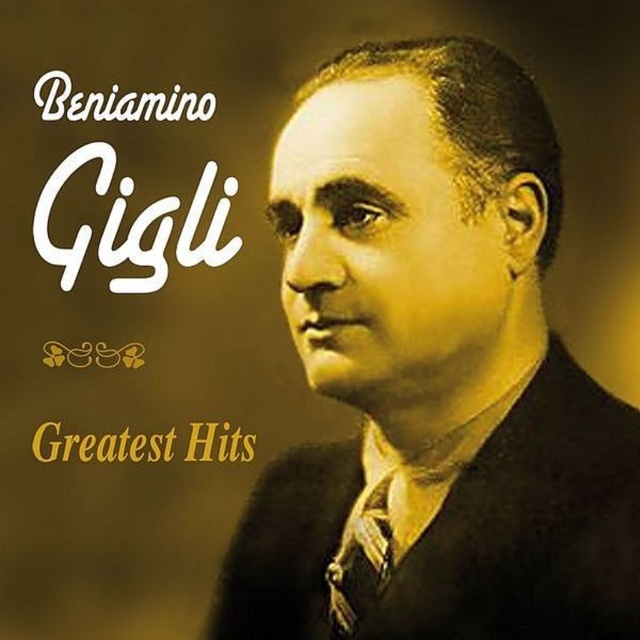
Is black wool business suit at center above matte black tie at center?

Indeed, black wool business suit at center is positioned over matte black tie at center.

Does point (573, 531) lie behind point (353, 618)?

No, (573, 531) is in front of (353, 618).

Who is more distant from viewer, (618, 550) or (376, 483)?

Positioned behind is point (376, 483).

What are the coordinates of `black wool business suit at center` in the screenshot? It's located at (529, 525).

Is white paper text at upper left bigger than matte black tie at center?

Indeed, white paper text at upper left has a larger size compared to matte black tie at center.

Can you confirm if white paper text at upper left is positioned to the left of matte black tie at center?

Yes, white paper text at upper left is to the left of matte black tie at center.

Where is `white paper text at upper left`? white paper text at upper left is located at coordinates (164, 234).

You are a GUI agent. You are given a task and a screenshot of the screen. Output one action in this format:
    pyautogui.click(x=<x>, y=<y>)
    Task: Click on the white paper text at upper left
    
    Given the screenshot: What is the action you would take?
    pyautogui.click(x=164, y=234)

Which of these two, matte black suit at center or white paper text at upper left, stands taller?

With more height is matte black suit at center.

You are a GUI agent. You are given a task and a screenshot of the screen. Output one action in this format:
    pyautogui.click(x=<x>, y=<y>)
    Task: Click on the matte black suit at center
    This screenshot has width=640, height=640.
    Given the screenshot: What is the action you would take?
    pyautogui.click(x=436, y=368)